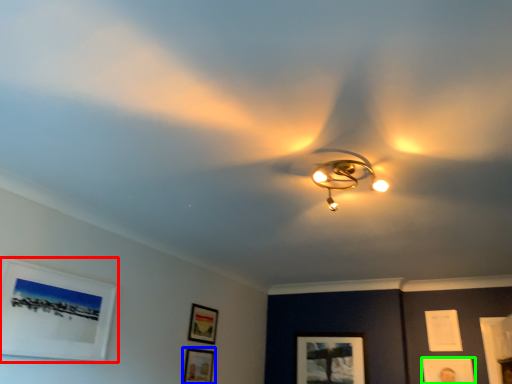
Question: Estimate the real-world distances between objects in this image. Which object is closer to picture frame (highlighted by a red box), picture frame (highlighted by a blue box) or picture frame (highlighted by a green box)?

Choices:
 (A) picture frame
 (B) picture frame

Answer: (A)